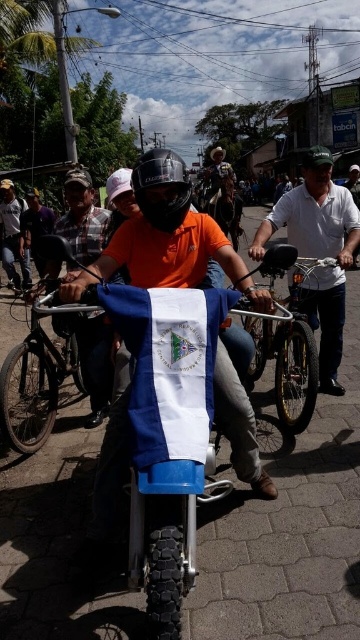
Question: Based on their relative distances, which object is farther from the blue matte bicycle at center?

Choices:
 (A) matte orange shirt at center
 (B) blue fabric flag at center
 (C) metallic silver bicycle at center

Answer: (A)

Question: Considering the relative positions of blue matte bicycle at center and orange shirt at center in the image provided, where is blue matte bicycle at center located with respect to orange shirt at center?

Choices:
 (A) below
 (B) above

Answer: (A)

Question: Among these points, which one is farthest from the camera?

Choices:
 (A) (353, 220)
 (B) (168, 451)
 (C) (30, 230)
 (D) (19, 248)

Answer: (C)

Question: Does blue matte bicycle at center come in front of matte orange shirt at center?

Choices:
 (A) yes
 (B) no

Answer: (A)

Question: Is blue fabric flag at center wider than blue matte bicycle at center?

Choices:
 (A) yes
 (B) no

Answer: (B)

Question: Which point appears closest to the camera in this image?

Choices:
 (A) (42, 228)
 (B) (3, 230)
 (C) (297, 250)
 (D) (330, 340)

Answer: (C)